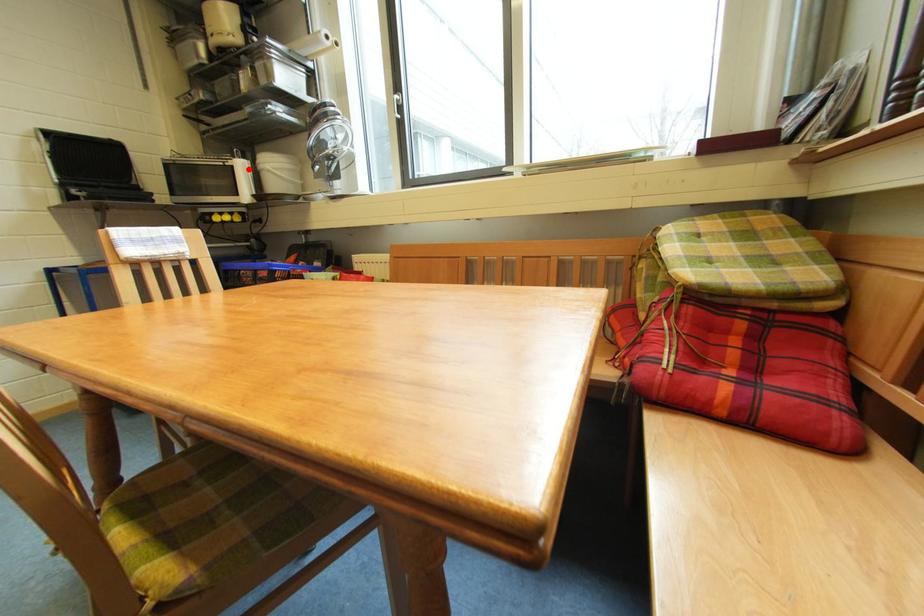
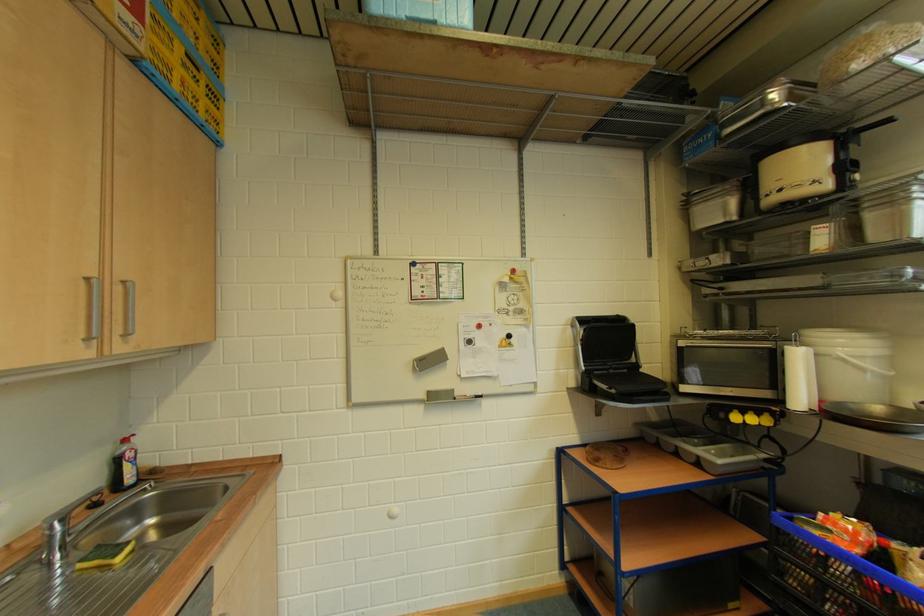
Locate, in the second image, the point that corresponds to the highlighted location in the first image.

(805, 359)